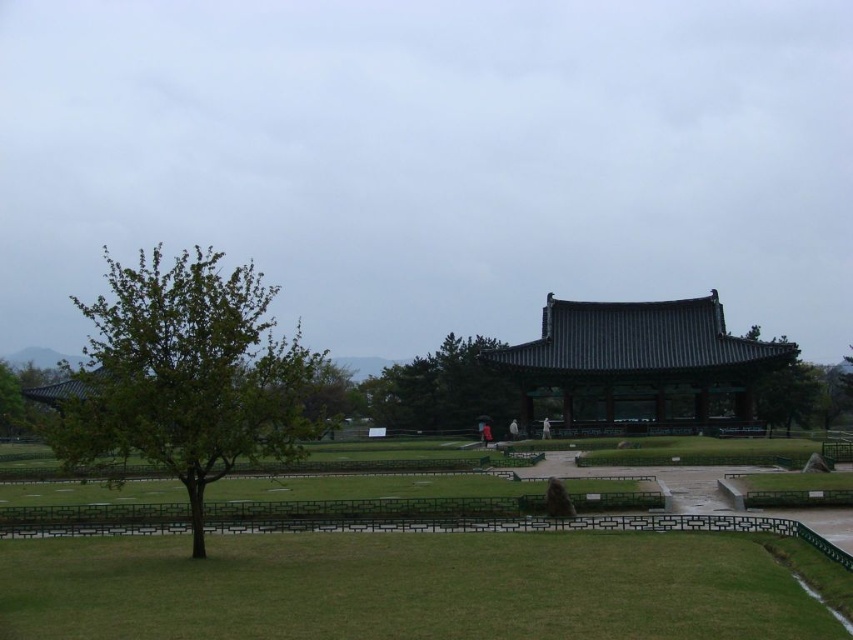
You are standing in the park and see two points marked in the scene. Which point, point (614, 332) or point (492, 388), is closer to you?

Point (614, 332) is closer to the camera than point (492, 388), so the point closer to you is point (614, 332).

You are a landscape architect designing a walking path between the green leafy tree at left and the green leafy tree at center. What is the minimum width required for the path to ensure there is at least 5 meters of clearance between the trees and the path edges?

The distance between the green leafy tree at left and the green leafy tree at center is 23.26 meters. To ensure at least 5 meters of clearance from each tree to the path edges, the path must be at least 23.26 meters minus 10 meters, which equals 13.26 meters wide.